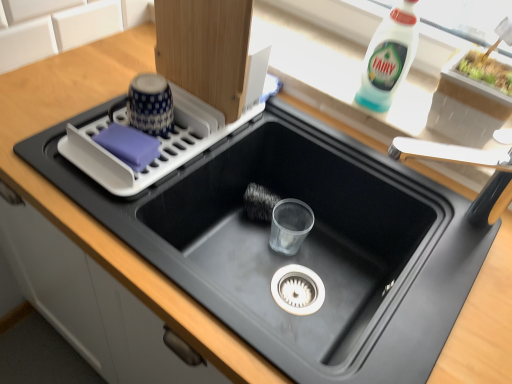
I want to click on vacant space in front of white plastic faucet at upper right, so click(451, 276).